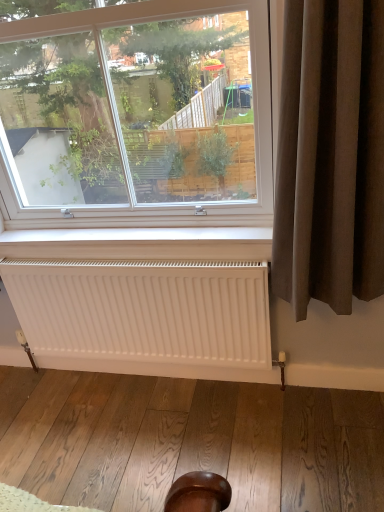
Where is `free location to the right of white matte radiator at lower center`? Image resolution: width=384 pixels, height=512 pixels. free location to the right of white matte radiator at lower center is located at coordinates (267, 419).